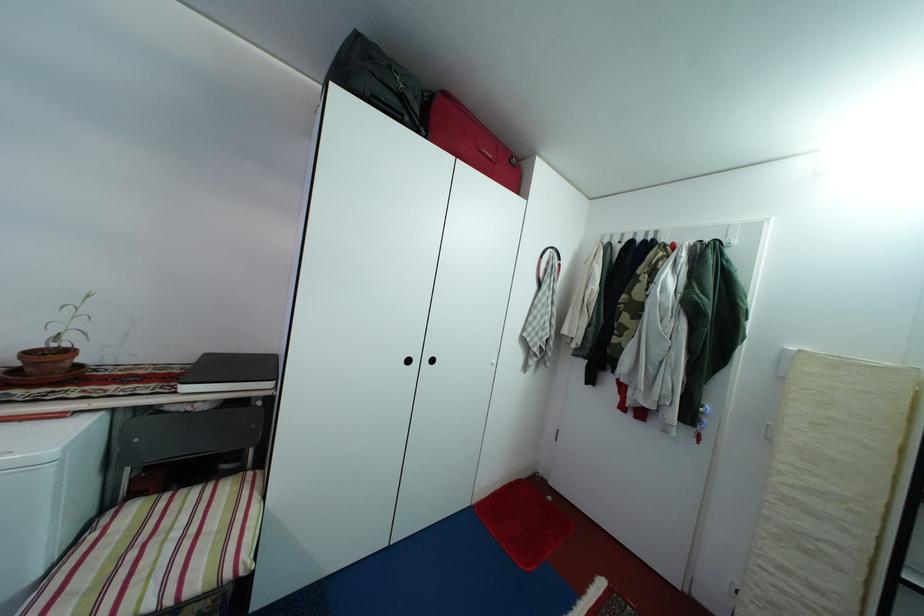
Where would you pull the white cabinet knob? Please return your answer as a coordinate pair (x, y).

(495, 362)